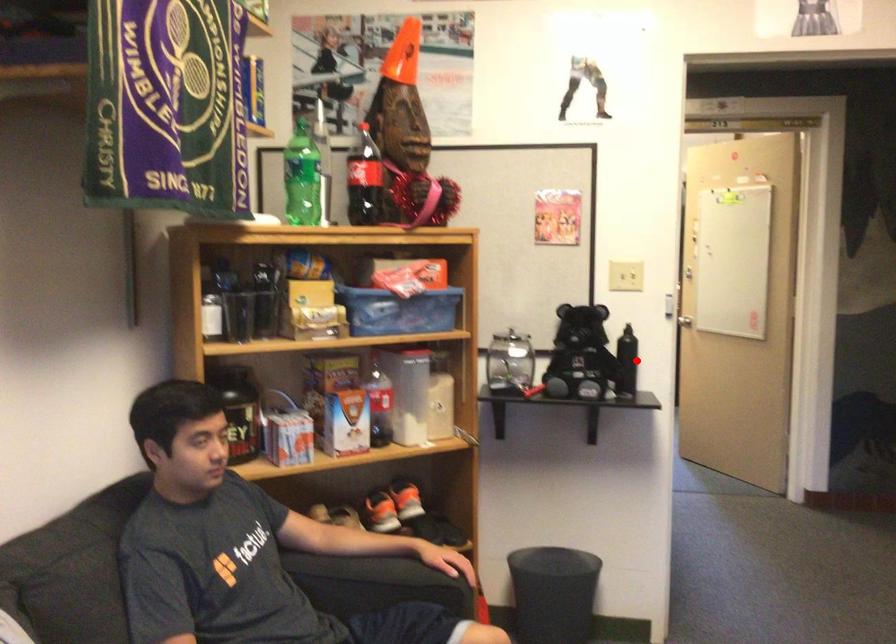
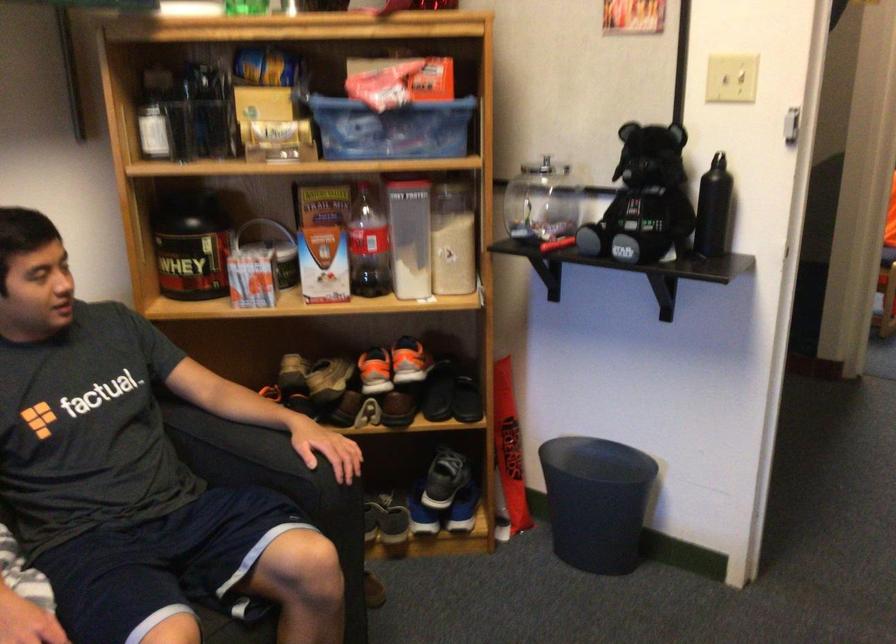
Where in the second image is the point corresponding to the highlighted location from the first image?

(712, 209)